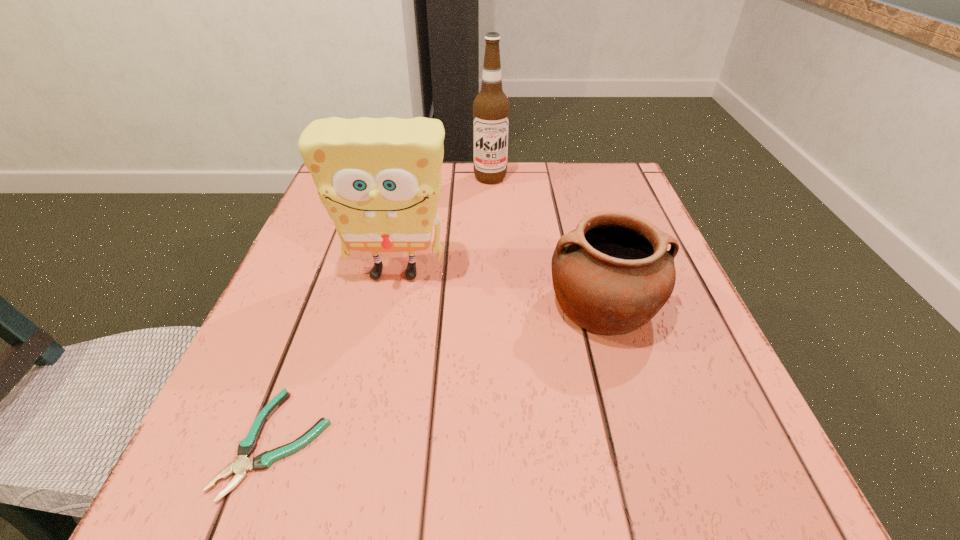
Identify the location of blank space at the right edge. (627, 337).

Where is `vacant space at the near left corner`? The height and width of the screenshot is (540, 960). vacant space at the near left corner is located at coordinates (300, 458).

In the image, there is a desktop. At what (x,y) coordinates should I click in order to perform the action: click on free region at the far right corner. Please return your answer as a coordinate pair (x, y). The height and width of the screenshot is (540, 960). Looking at the image, I should click on (588, 195).

In order to click on free space between the shortest object and the second shortest object in this screenshot , I will do `click(440, 373)`.

Where is `empty space between the shortest object and the pottery`? Image resolution: width=960 pixels, height=540 pixels. empty space between the shortest object and the pottery is located at coordinates (440, 373).

The image size is (960, 540). I want to click on vacant area that lies between the rightmost object and the second object from right to left, so click(x=546, y=241).

This screenshot has width=960, height=540. Identify the location of vacant point located between the pottery and the shortest object. (440, 373).

Locate an element on the screen. This screenshot has width=960, height=540. free spot between the sponge and the alcohol is located at coordinates (443, 225).

You are a GUI agent. You are given a task and a screenshot of the screen. Output one action in this format:
    pyautogui.click(x=<x>, y=<y>)
    Task: Click on the free spot between the third shortest object and the pottery
    
    Given the screenshot: What is the action you would take?
    pyautogui.click(x=499, y=288)

Find the location of a particular element. This screenshot has width=960, height=540. unoccupied position between the nearest object and the third shortest object is located at coordinates (336, 357).